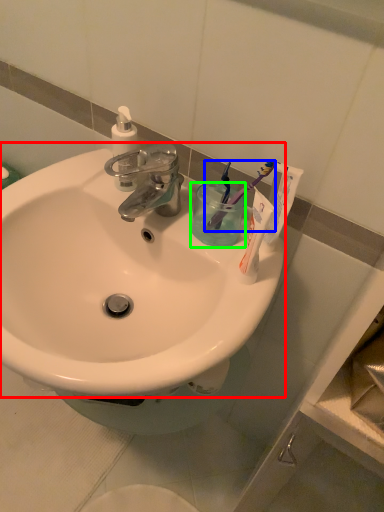
Question: Which object is the farthest from sink (highlighted by a red box)? Choose among these: toothbrush (highlighted by a blue box) or liquid (highlighted by a green box).

Choices:
 (A) toothbrush
 (B) liquid

Answer: (A)